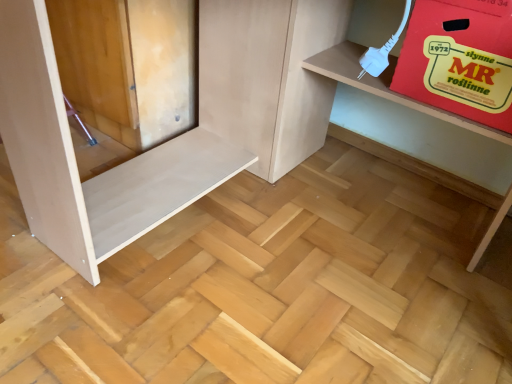
Question: Looking at their shapes, would you say red cardboard box at upper right is wider or thinner than matte cardboard box at upper right?

Choices:
 (A) thin
 (B) wide

Answer: (A)

Question: From their relative heights in the image, would you say red cardboard box at upper right is taller or shorter than matte cardboard box at upper right?

Choices:
 (A) short
 (B) tall

Answer: (A)

Question: Considering the positions of point (431, 36) and point (309, 77), is point (431, 36) closer or farther from the camera than point (309, 77)?

Choices:
 (A) farther
 (B) closer

Answer: (B)

Question: Is point (13, 69) positioned closer to the camera than point (468, 92)?

Choices:
 (A) farther
 (B) closer

Answer: (B)

Question: From a real-world perspective, relative to red cardboard box at upper right, is matte cardboard box at upper right vertically above or below?

Choices:
 (A) above
 (B) below

Answer: (B)

Question: In terms of height, does matte cardboard box at upper right look taller or shorter compared to red cardboard box at upper right?

Choices:
 (A) short
 (B) tall

Answer: (B)

Question: Is matte cardboard box at upper right in front of or behind red cardboard box at upper right in the image?

Choices:
 (A) front
 (B) behind

Answer: (A)